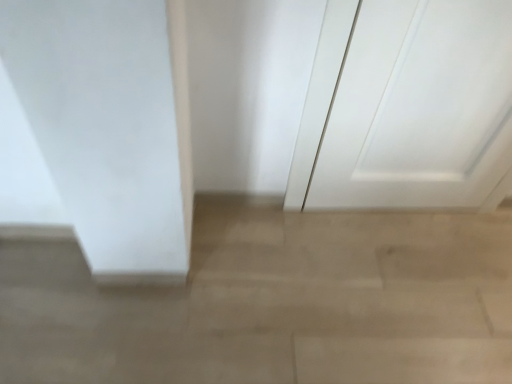
Question: In the image, is white matte door at upper right positioned in front of or behind beige polished concrete at center?

Choices:
 (A) front
 (B) behind

Answer: (A)

Question: From a real-world perspective, relative to beige polished concrete at center, is white matte door at upper right vertically above or below?

Choices:
 (A) below
 (B) above

Answer: (B)

Question: Considering the positions of white matte door at upper right and beige polished concrete at center in the image, is white matte door at upper right wider or thinner than beige polished concrete at center?

Choices:
 (A) thin
 (B) wide

Answer: (A)

Question: Which is correct: beige polished concrete at center is inside white matte door at upper right, or outside of it?

Choices:
 (A) outside
 (B) inside

Answer: (A)

Question: From a real-world perspective, is beige polished concrete at center above or below white matte door at upper right?

Choices:
 (A) above
 (B) below

Answer: (B)

Question: In the image, is beige polished concrete at center positioned in front of or behind white matte door at upper right?

Choices:
 (A) front
 (B) behind

Answer: (B)

Question: From their relative heights in the image, would you say beige polished concrete at center is taller or shorter than white matte door at upper right?

Choices:
 (A) short
 (B) tall

Answer: (A)